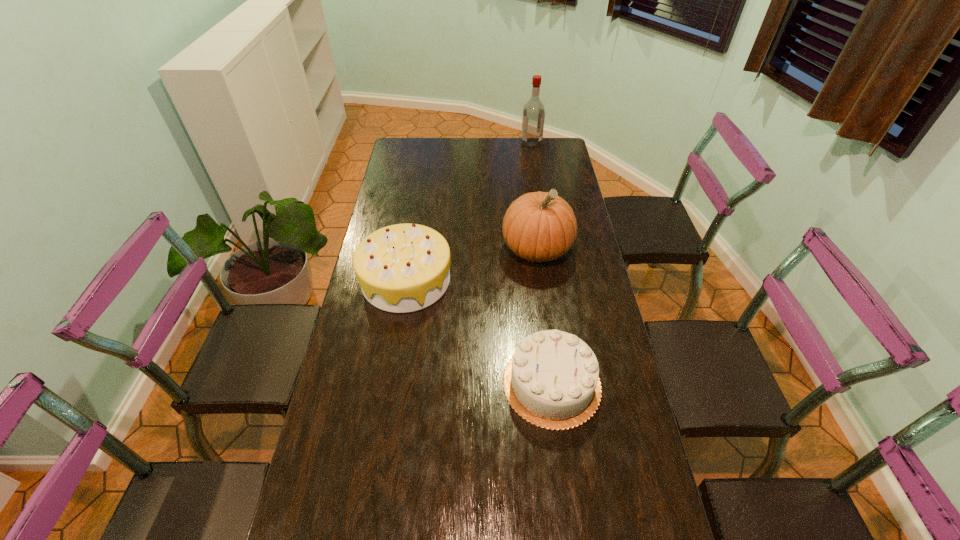
The image size is (960, 540). What are the coordinates of `vacant space located 0.070m on the front of the leftmost object` in the screenshot? It's located at (397, 333).

You are a GUI agent. You are given a task and a screenshot of the screen. Output one action in this format:
    pyautogui.click(x=<x>, y=<y>)
    Task: Click on the vacant space situated 0.170m on the back of the right birthday cake
    
    Given the screenshot: What is the action you would take?
    pyautogui.click(x=541, y=301)

You are a GUI agent. You are given a task and a screenshot of the screen. Output one action in this format:
    pyautogui.click(x=<x>, y=<y>)
    Task: Click on the object that is at the far edge
    Image resolution: width=960 pixels, height=540 pixels.
    Given the screenshot: What is the action you would take?
    533,119

Image resolution: width=960 pixels, height=540 pixels. Find the location of `object located at the left edge`. object located at the left edge is located at coordinates (401, 268).

I want to click on liquor that is positioned at the right edge, so click(x=533, y=119).

At what (x,y) coordinates should I click in order to perform the action: click on pumpkin that is at the right edge. Please return your answer as a coordinate pair (x, y). Looking at the image, I should click on coord(539,226).

Locate an element on the screen. Image resolution: width=960 pixels, height=540 pixels. birthday cake located in the right edge section of the desktop is located at coordinates (552, 381).

Where is `object situated at the far right corner`? Image resolution: width=960 pixels, height=540 pixels. object situated at the far right corner is located at coordinates (533, 119).

In the image, there is a desktop. In order to click on vacant space at the far edge in this screenshot , I will do `click(433, 140)`.

The width and height of the screenshot is (960, 540). In the image, there is a desktop. In order to click on vacant area at the left edge in this screenshot , I will do coord(346,457).